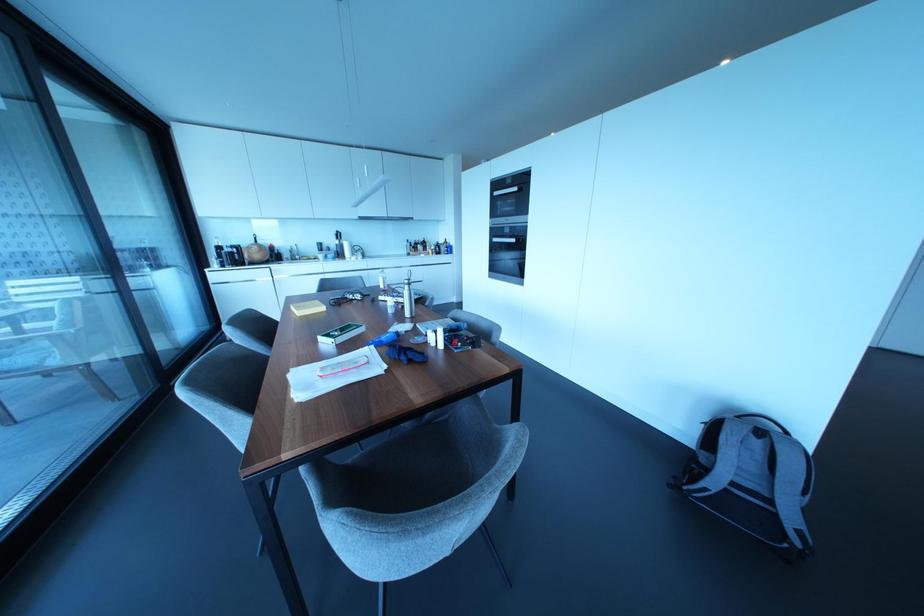
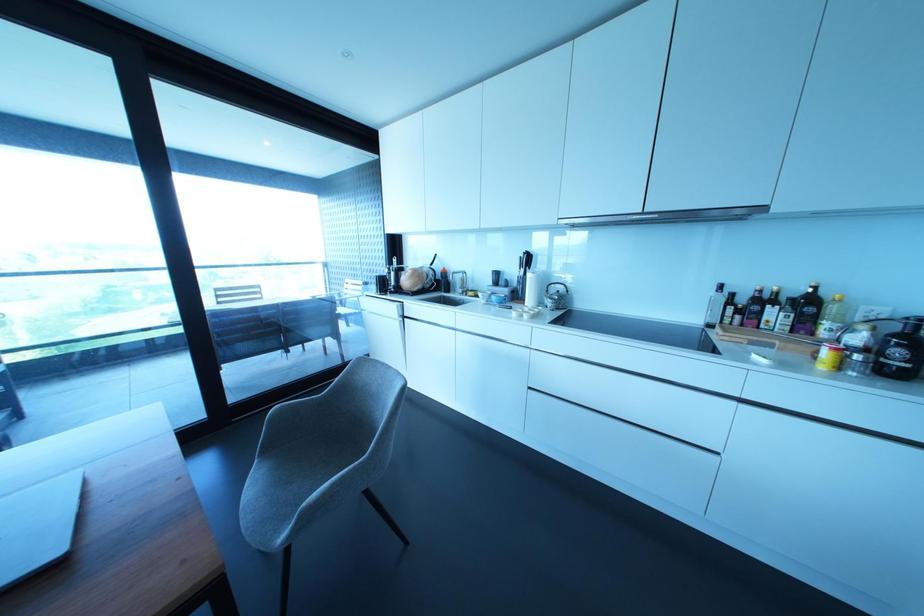
Locate, in the second image, the point that corresponds to (430,251) in the first image.

(825, 353)